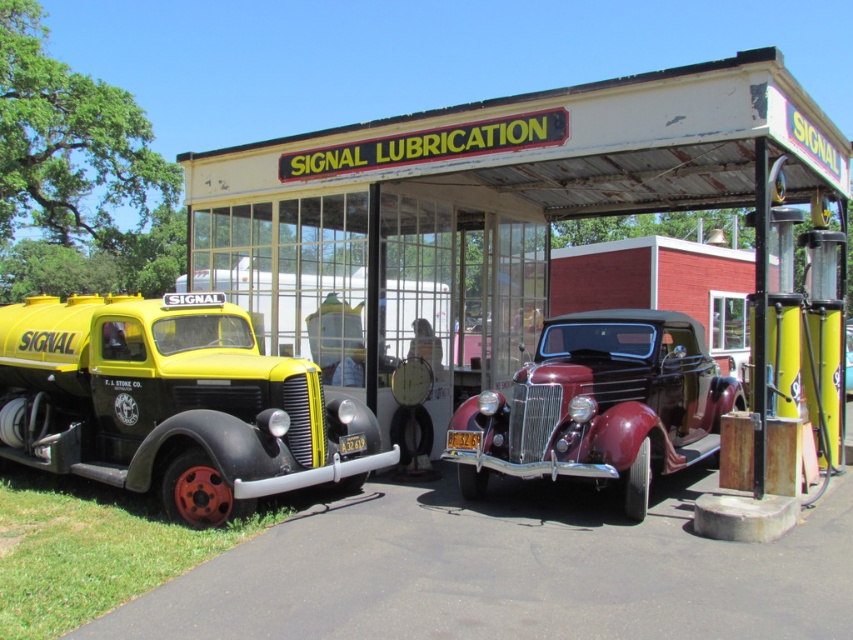
Which is behind, point (194, 426) or point (469, 467)?

The point (469, 467) is behind.

Between yellow matte truck at left and shiny maroon convertible at center, which one has less height?

yellow matte truck at left is shorter.

Describe the element at coordinates (173, 404) in the screenshot. The width and height of the screenshot is (853, 640). I see `yellow matte truck at left` at that location.

Locate an element on the screen. The width and height of the screenshot is (853, 640). yellow matte truck at left is located at coordinates (173, 404).

Does rusty metal gas station at center appear on the left side of yellow matte truck at left?

In fact, rusty metal gas station at center is to the right of yellow matte truck at left.

Which of these two, rusty metal gas station at center or yellow matte truck at left, stands taller?

With more height is rusty metal gas station at center.

Is point (445, 348) more distant than point (137, 316)?

Yes, it is behind point (137, 316).

This screenshot has width=853, height=640. What are the coordinates of `rusty metal gas station at center` in the screenshot? It's located at (479, 216).

In the scene shown: Measure the distance between rusty metal gas station at center and shiny maroon convertible at center.

rusty metal gas station at center and shiny maroon convertible at center are 5.08 feet apart from each other.

Does rusty metal gas station at center appear on the left side of shiny maroon convertible at center?

Yes, rusty metal gas station at center is to the left of shiny maroon convertible at center.

Is point (770, 86) farther from viewer compared to point (660, 355)?

No, (770, 86) is in front of (660, 355).

Where is `rusty metal gas station at center`? rusty metal gas station at center is located at coordinates (479, 216).